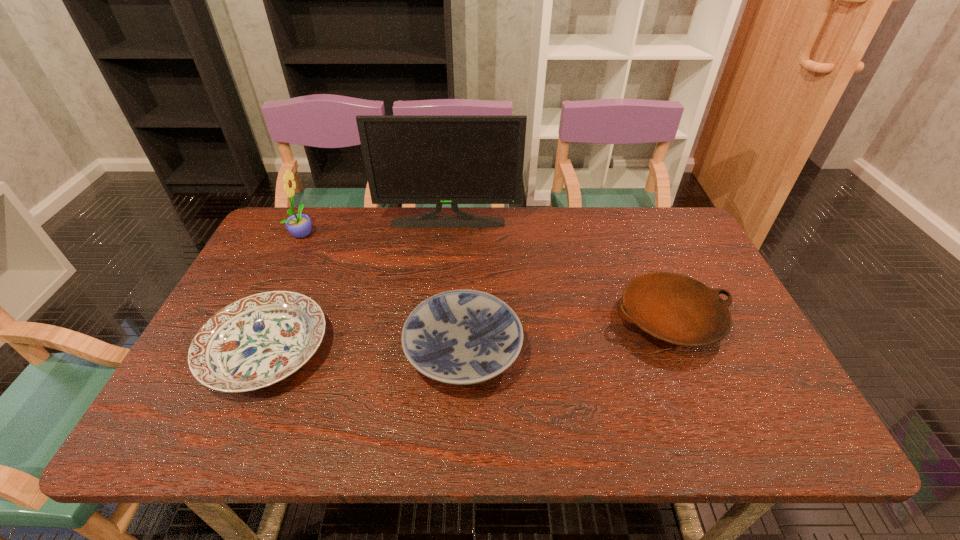
I want to click on plate object that ranks as the second closest to the shortest object, so click(x=674, y=308).

Locate an element on the screen. The width and height of the screenshot is (960, 540). vacant area in the image that satisfies the following two spatial constraints: 1. on the front-facing side of the rightmost plate; 2. on the left side of the second tallest object is located at coordinates (261, 320).

Where is `blank area in the image that satisfies the following two spatial constraints: 1. on the front-facing side of the second plate from right to left; 2. on the right side of the tallest object`? blank area in the image that satisfies the following two spatial constraints: 1. on the front-facing side of the second plate from right to left; 2. on the right side of the tallest object is located at coordinates (436, 351).

At what (x,y) coordinates should I click in order to perform the action: click on free point that satisfies the following two spatial constraints: 1. on the front-facing side of the monitor; 2. on the right side of the second plate from right to left. Please return your answer as a coordinate pair (x, y). This screenshot has width=960, height=540. Looking at the image, I should click on (436, 351).

In order to click on vacant region that satisfies the following two spatial constraints: 1. on the back side of the second plate from right to left; 2. on the left side of the rightmost object in this screenshot , I will do `click(465, 320)`.

Where is `vacant region that satisfies the following two spatial constraints: 1. on the front-facing side of the fourth shortest object; 2. on the right side of the second plate from left to right`? The image size is (960, 540). vacant region that satisfies the following two spatial constraints: 1. on the front-facing side of the fourth shortest object; 2. on the right side of the second plate from left to right is located at coordinates (247, 351).

The width and height of the screenshot is (960, 540). In order to click on vacant space that satisfies the following two spatial constraints: 1. on the front-facing side of the tallest object; 2. on the front-facing side of the fourth shortest object in this screenshot , I will do `click(446, 233)`.

Find the location of `vacant space that satisfies the following two spatial constraints: 1. on the back side of the shortest object; 2. on the front-facing side of the sunflower`. vacant space that satisfies the following two spatial constraints: 1. on the back side of the shortest object; 2. on the front-facing side of the sunflower is located at coordinates (318, 233).

The width and height of the screenshot is (960, 540). Find the location of `vacant position in the image that satisfies the following two spatial constraints: 1. on the front-facing side of the sunflower; 2. on the left side of the second plate from left to right`. vacant position in the image that satisfies the following two spatial constraints: 1. on the front-facing side of the sunflower; 2. on the left side of the second plate from left to right is located at coordinates (247, 351).

Image resolution: width=960 pixels, height=540 pixels. I want to click on free spot that satisfies the following two spatial constraints: 1. on the front-facing side of the rightmost object; 2. on the right side of the second tallest object, so click(x=261, y=320).